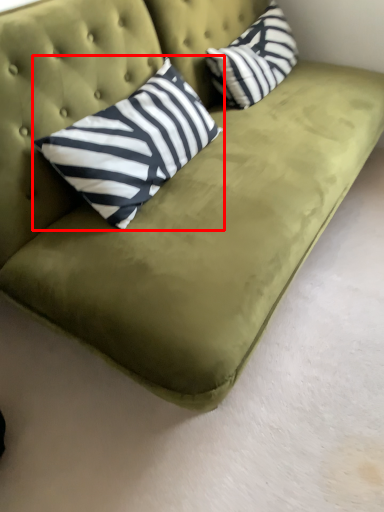
Question: Considering the relative positions of pillow (annotated by the red box) and pillow in the image provided, where is pillow (annotated by the red box) located with respect to the staircase?

Choices:
 (A) right
 (B) left

Answer: (B)